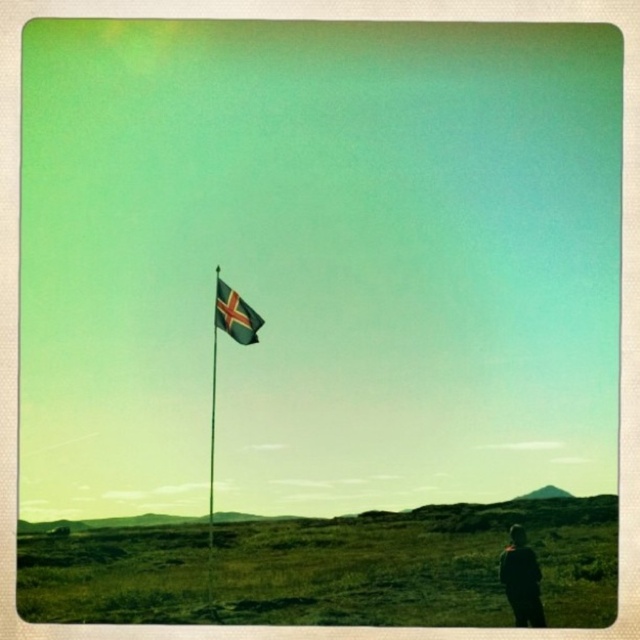
Question: Is silky fabric flag at center to the right of white/black striped flag pole at center from the viewer's perspective?

Choices:
 (A) yes
 (B) no

Answer: (A)

Question: Which point is closer to the camera?

Choices:
 (A) dark fabric jacket at lower right
 (B) white/black striped flag pole at center

Answer: (A)

Question: Which point is farther to the camera?

Choices:
 (A) (209, 564)
 (B) (228, 289)

Answer: (B)

Question: Is dark fabric jacket at lower right to the left of white/black striped flag pole at center from the viewer's perspective?

Choices:
 (A) no
 (B) yes

Answer: (A)

Question: Based on their relative distances, which object is nearer to the white/black striped flag pole at center?

Choices:
 (A) silky fabric flag at center
 (B) dark fabric jacket at lower right

Answer: (A)

Question: Is dark fabric jacket at lower right to the left of white/black striped flag pole at center from the viewer's perspective?

Choices:
 (A) no
 (B) yes

Answer: (A)